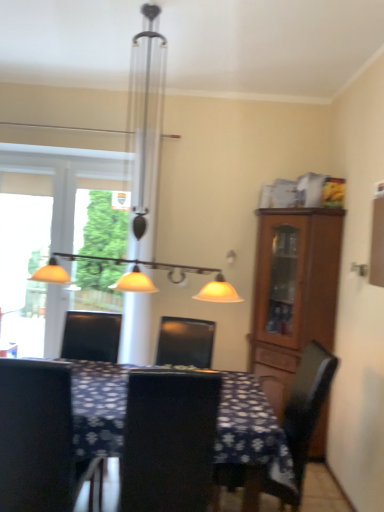
Question: Which direction should I rotate to look at black leather chair at center, which appears as the 2th chair when viewed from the right, — up or down?

Choices:
 (A) up
 (B) down

Answer: (B)

Question: Does dark brown wooden chair at right, positioned as the first chair in right-to-left order, have a greater width compared to dark blue fabric table at center?

Choices:
 (A) no
 (B) yes

Answer: (A)

Question: Is dark brown wooden chair at right, positioned as the first chair in right-to-left order, not inside dark blue fabric table at center?

Choices:
 (A) yes
 (B) no

Answer: (B)

Question: Does dark brown wooden chair at right, positioned as the first chair in right-to-left order, have a lesser height compared to dark blue fabric table at center?

Choices:
 (A) yes
 (B) no

Answer: (B)

Question: Is dark brown wooden chair at right, the 3th chair when ordered from left to right, positioned far away from dark blue fabric table at center?

Choices:
 (A) yes
 (B) no

Answer: (B)

Question: Does dark brown wooden chair at right, the 3th chair when ordered from left to right, appear on the right side of dark blue fabric table at center?

Choices:
 (A) yes
 (B) no

Answer: (A)

Question: Considering the relative sizes of dark brown wooden chair at right, positioned as the first chair in right-to-left order, and dark blue fabric table at center in the image provided, is dark brown wooden chair at right, positioned as the first chair in right-to-left order, bigger than dark blue fabric table at center?

Choices:
 (A) no
 (B) yes

Answer: (A)

Question: Is black matte chair at left, which is the 3th chair in right-to-left order, positioned before brown wooden cabinet at right?

Choices:
 (A) no
 (B) yes

Answer: (B)

Question: Is black matte chair at left, marked as the 1th chair in a left-to-right arrangement, located outside brown wooden cabinet at right?

Choices:
 (A) no
 (B) yes

Answer: (B)

Question: Is black matte chair at left, which is the 3th chair in right-to-left order, bigger than brown wooden cabinet at right?

Choices:
 (A) no
 (B) yes

Answer: (A)

Question: From the image's perspective, is black matte chair at left, marked as the 1th chair in a left-to-right arrangement, on brown wooden cabinet at right?

Choices:
 (A) yes
 (B) no

Answer: (B)

Question: Can you confirm if black matte chair at left, which is the 3th chair in right-to-left order, is smaller than brown wooden cabinet at right?

Choices:
 (A) yes
 (B) no

Answer: (A)

Question: Is black matte chair at left, marked as the 1th chair in a left-to-right arrangement, wider than brown wooden cabinet at right?

Choices:
 (A) no
 (B) yes

Answer: (B)

Question: Considering the relative positions of brown wooden cabinet at right and dark blue fabric table at center in the image provided, is brown wooden cabinet at right behind dark blue fabric table at center?

Choices:
 (A) yes
 (B) no

Answer: (A)